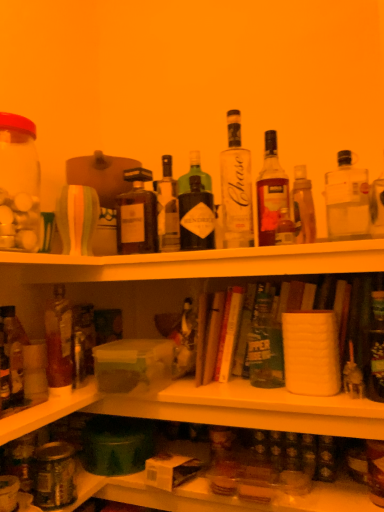
Locate an element on the screen. This screenshot has height=512, width=384. clear glass bottle at center, the sixth bottle when ordered from right to left is located at coordinates (236, 188).

What do you see at coordinates (236, 188) in the screenshot? I see `clear glass bottle at center, positioned as the 5th bottle in left-to-right order` at bounding box center [236, 188].

What is the approximate width of matte glass bottle at center, which is the 8th bottle from right to left?

It is 3.67 inches.

Identify the location of matte glass bottle at center, which is the 8th bottle from right to left. This screenshot has width=384, height=512. (137, 215).

What is the approximate height of translucent glass jar at left?

31.41 centimeters.

Image resolution: width=384 pixels, height=512 pixels. What do you see at coordinates (303, 207) in the screenshot?
I see `translucent glass bottle at upper center, the eighth bottle positioned from the left` at bounding box center [303, 207].

What do you see at coordinates (167, 209) in the screenshot? The width and height of the screenshot is (384, 512). I see `translucent glass bottle at center, arranged as the 7th bottle when viewed from the right` at bounding box center [167, 209].

Identify the location of clear glass bottle at center, positioned as the 5th bottle in left-to-right order. (236, 188).

From the image's perspective, which is above, clear glass bottle at upper right, acting as the second bottle starting from the right, or matte glass bottle at center, placed as the 3th bottle when sorted from left to right?

clear glass bottle at upper right, acting as the second bottle starting from the right.

Would you say clear glass bottle at upper right, the ninth bottle positioned from the left, is inside or outside matte glass bottle at center, placed as the 3th bottle when sorted from left to right?

clear glass bottle at upper right, the ninth bottle positioned from the left, exists outside the volume of matte glass bottle at center, placed as the 3th bottle when sorted from left to right.

Is there a large distance between clear glass bottle at upper right, acting as the second bottle starting from the right, and matte glass bottle at center, which is the 8th bottle from right to left?

Actually, clear glass bottle at upper right, acting as the second bottle starting from the right, and matte glass bottle at center, which is the 8th bottle from right to left, are a little close together.

From a real-world perspective, does translucent glass bottle at center, arranged as the 7th bottle when viewed from the right, stand above translucent glass bottle at left, which appears as the ninth bottle when viewed from the right?

Correct, in the physical world, translucent glass bottle at center, arranged as the 7th bottle when viewed from the right, is higher than translucent glass bottle at left, which appears as the ninth bottle when viewed from the right.

Considering the relative sizes of translucent glass bottle at center, which appears as the 4th bottle when viewed from the left, and translucent glass bottle at left, which appears as the ninth bottle when viewed from the right, in the image provided, is translucent glass bottle at center, which appears as the 4th bottle when viewed from the left, wider than translucent glass bottle at left, which appears as the ninth bottle when viewed from the right,?

Indeed, translucent glass bottle at center, which appears as the 4th bottle when viewed from the left, has a greater width compared to translucent glass bottle at left, which appears as the ninth bottle when viewed from the right.

How far apart are translucent glass bottle at center, arranged as the 7th bottle when viewed from the right, and translucent glass bottle at left, which appears as the ninth bottle when viewed from the right?

They are 14.51 inches apart.

Is the position of translucent glass bottle at center, arranged as the 7th bottle when viewed from the right, less distant than that of translucent glass bottle at left, placed as the 2th bottle when sorted from left to right?

No, translucent glass bottle at center, arranged as the 7th bottle when viewed from the right, is further to the viewer.

Where is `bottle that is the 1st one when counting forward from the translucent glass bottle at upper center, which is counted as the seventh bottle, starting from the left`? The width and height of the screenshot is (384, 512). bottle that is the 1st one when counting forward from the translucent glass bottle at upper center, which is counted as the seventh bottle, starting from the left is located at coordinates (236, 188).

Choose the correct answer: Is clear glass bottle at center, the sixth bottle when ordered from right to left, inside translucent glass bottle at upper center, arranged as the 4th bottle when viewed from the right, or outside it?

clear glass bottle at center, the sixth bottle when ordered from right to left, lies outside translucent glass bottle at upper center, arranged as the 4th bottle when viewed from the right.

From the image's perspective, which is below, clear glass bottle at center, the sixth bottle when ordered from right to left, or translucent glass bottle at upper center, arranged as the 4th bottle when viewed from the right?

translucent glass bottle at upper center, arranged as the 4th bottle when viewed from the right.

From a real-world perspective, is translucent glass bottle at center, which appears as the 4th bottle when viewed from the left, located higher than green matte beer bottle at center, acting as the 6th bottle starting from the left?

Yes, from a real-world perspective, translucent glass bottle at center, which appears as the 4th bottle when viewed from the left, is above green matte beer bottle at center, acting as the 6th bottle starting from the left.

Is green matte beer bottle at center, placed as the 5th bottle when sorted from right to left, located within translucent glass bottle at center, arranged as the 7th bottle when viewed from the right?

No.

Consider the image. Can you confirm if translucent glass bottle at center, which appears as the 4th bottle when viewed from the left, is taller than green matte beer bottle at center, placed as the 5th bottle when sorted from right to left?

Yes, translucent glass bottle at center, which appears as the 4th bottle when viewed from the left, is taller than green matte beer bottle at center, placed as the 5th bottle when sorted from right to left.

Based on their positions, is translucent glass bottle at center, which appears as the 4th bottle when viewed from the left, located to the left or right of green matte beer bottle at center, acting as the 6th bottle starting from the left?

Based on their positions, translucent glass bottle at center, which appears as the 4th bottle when viewed from the left, is located to the left of green matte beer bottle at center, acting as the 6th bottle starting from the left.

Between translucent glass jar at left and translucent glass bottle at lower right, which is the 10th bottle from left to right, which one has less height?

With less height is translucent glass bottle at lower right, which is the 10th bottle from left to right.

Does point (7, 126) come in front of point (379, 307)?

Yes.

Consider the image. Does translucent glass jar at left have a larger size compared to translucent glass bottle at lower right, which is the 10th bottle from left to right?

Yes, translucent glass jar at left is bigger than translucent glass bottle at lower right, which is the 10th bottle from left to right.

From the image's perspective, is translucent glass jar at left under translucent glass bottle at lower right, which is the 10th bottle from left to right?

Actually, translucent glass jar at left appears above translucent glass bottle at lower right, which is the 10th bottle from left to right, in the image.

This screenshot has width=384, height=512. I want to click on bottle that is the 7th object directly below the translucent glass jar at left (from a real-world perspective), so click(265, 345).

Considering the relative sizes of translucent glass jar at left and green matte beer bottle at center, acting as the 6th bottle starting from the left, in the image provided, is translucent glass jar at left shorter than green matte beer bottle at center, acting as the 6th bottle starting from the left,?

No, translucent glass jar at left is not shorter than green matte beer bottle at center, acting as the 6th bottle starting from the left.

Is translucent glass jar at left facing away from green matte beer bottle at center, placed as the 5th bottle when sorted from right to left?

translucent glass jar at left is not turned away from green matte beer bottle at center, placed as the 5th bottle when sorted from right to left.

Does translucent glass jar at left have a larger size compared to translucent glass bottle at center, which appears as the 4th bottle when viewed from the left?

Yes, translucent glass jar at left is bigger than translucent glass bottle at center, which appears as the 4th bottle when viewed from the left.

Is translucent glass jar at left positioned with its back to translucent glass bottle at center, which appears as the 4th bottle when viewed from the left?

translucent glass jar at left does not have its back to translucent glass bottle at center, which appears as the 4th bottle when viewed from the left.

Which object is positioned more to the left, translucent glass jar at left or translucent glass bottle at center, which appears as the 4th bottle when viewed from the left?

From the viewer's perspective, translucent glass jar at left appears more on the left side.

Can translucent glass bottle at center, arranged as the 7th bottle when viewed from the right, be found inside translucent glass jar at left?

Actually, translucent glass bottle at center, arranged as the 7th bottle when viewed from the right, is outside translucent glass jar at left.

Which bottle is the 6th one when counting from the right side of the matte glass bottle at center, which is the 8th bottle from right to left? Please provide its 2D coordinates.

[(347, 199)]

Identify the location of bottle that is the 2nd object located in front of the translucent glass bottle at center, arranged as the 7th bottle when viewed from the right. The height and width of the screenshot is (512, 384). (59, 341).

Looking at this image, considering their positions, is translucent glass bottle at center, arranged as the 7th bottle when viewed from the right, positioned further to clear glass bottle at center, positioned as the 5th bottle in left-to-right order, than translucent glass bottle at upper center, which is counted as the seventh bottle, starting from the left?

translucent glass bottle at center, arranged as the 7th bottle when viewed from the right, is positioned further to the anchor clear glass bottle at center, positioned as the 5th bottle in left-to-right order.

Estimate the real-world distances between objects in this image. Which object is further from matte glass bottle at center, placed as the 3th bottle when sorted from left to right, clear glass bottle at center, the sixth bottle when ordered from right to left, or clear glass bottle at upper right, the ninth bottle positioned from the left?

Among the two, clear glass bottle at upper right, the ninth bottle positioned from the left, is located further to matte glass bottle at center, placed as the 3th bottle when sorted from left to right.

Looking at the image, which one is located further to clear glass bottle at center, positioned as the 5th bottle in left-to-right order, translucent glass bottle at lower right, the first bottle when ordered from right to left, or translucent glass bottle at left, which appears as the ninth bottle when viewed from the right?

translucent glass bottle at left, which appears as the ninth bottle when viewed from the right, is positioned further to the anchor clear glass bottle at center, positioned as the 5th bottle in left-to-right order.

From the image, which object appears to be farther from translucent glass jar at left, clear glass bottle at upper right, the ninth bottle positioned from the left, or translucent glass bottle at left, positioned as the 1th bottle in left-to-right order?

clear glass bottle at upper right, the ninth bottle positioned from the left, is further to translucent glass jar at left.

Looking at the image, which one is located further to translucent glass bottle at center, which appears as the 4th bottle when viewed from the left, matte glass bottle at center, which is the 8th bottle from right to left, or translucent glass bottle at left, which appears as the ninth bottle when viewed from the right?

translucent glass bottle at left, which appears as the ninth bottle when viewed from the right, is further to translucent glass bottle at center, which appears as the 4th bottle when viewed from the left.

Which object lies nearer to the anchor point translucent glass bottle at left, placed as the 2th bottle when sorted from left to right, clear glass bottle at upper right, the ninth bottle positioned from the left, or green matte beer bottle at center, acting as the 6th bottle starting from the left?

The object closer to translucent glass bottle at left, placed as the 2th bottle when sorted from left to right, is green matte beer bottle at center, acting as the 6th bottle starting from the left.

Looking at the image, which one is located further to green matte beer bottle at center, placed as the 5th bottle when sorted from right to left, matte glass bottle at center, placed as the 3th bottle when sorted from left to right, or clear glass bottle at center, positioned as the 5th bottle in left-to-right order?

Based on the image, matte glass bottle at center, placed as the 3th bottle when sorted from left to right, appears to be further to green matte beer bottle at center, placed as the 5th bottle when sorted from right to left.

Estimate the real-world distances between objects in this image. Which object is further from translucent glass bottle at upper center, which appears as the third bottle when viewed from the right, matte glass bottle at center, which is the 8th bottle from right to left, or translucent glass bottle at upper center, which is counted as the seventh bottle, starting from the left?

matte glass bottle at center, which is the 8th bottle from right to left, is positioned further to the anchor translucent glass bottle at upper center, which appears as the third bottle when viewed from the right.

Identify the location of bottle located between translucent glass bottle at upper center, which is counted as the seventh bottle, starting from the left, and clear glass bottle at upper right, the ninth bottle positioned from the left, in the left-right direction. Image resolution: width=384 pixels, height=512 pixels. (303, 207).

Identify the location of beverage located between translucent glass bottle at left, which appears as the tenth bottle when viewed from the right, and translucent glass bottle at upper center, arranged as the 4th bottle when viewed from the right, in the left-right direction. The height and width of the screenshot is (512, 384). (19, 184).

The image size is (384, 512). I want to click on glass jar located between translucent glass bottle at left, positioned as the 1th bottle in left-to-right order, and translucent glass bottle at upper center, which is counted as the seventh bottle, starting from the left, in the left-right direction, so click(x=54, y=475).

You are a GUI agent. You are given a task and a screenshot of the screen. Output one action in this format:
    pyautogui.click(x=<x>, y=<y>)
    Task: Click on the glass jar located between translucent glass bottle at left, positioned as the 1th bottle in left-to-right order, and clear glass bottle at upper right, the ninth bottle positioned from the left, in the left-right direction
    The width and height of the screenshot is (384, 512).
    Given the screenshot: What is the action you would take?
    (54, 475)